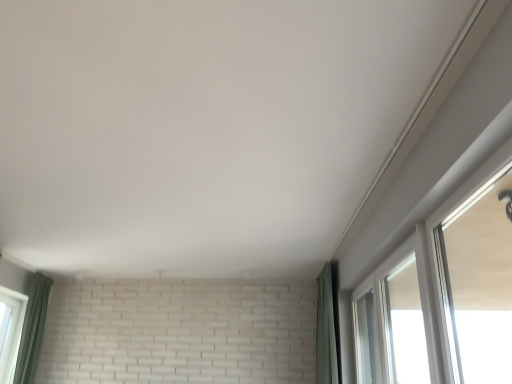
Question: Is white glossy window at upper right, positioned as the second window in back-to-front order, thinner than green fabric curtain at right, positioned as the 2th curtain in left-to-right order?

Choices:
 (A) no
 (B) yes

Answer: (B)

Question: Is white glossy window at upper right, positioned as the second window in back-to-front order, positioned behind green fabric curtain at right, positioned as the 2th curtain in left-to-right order?

Choices:
 (A) no
 (B) yes

Answer: (A)

Question: Considering the relative sizes of white glossy window at upper right, placed as the 1th window when sorted from front to back, and green fabric curtain at right, positioned as the 2th curtain in left-to-right order, in the image provided, is white glossy window at upper right, placed as the 1th window when sorted from front to back, wider than green fabric curtain at right, positioned as the 2th curtain in left-to-right order,?

Choices:
 (A) yes
 (B) no

Answer: (B)

Question: Could green fabric curtain at right, positioned as the 2th curtain in left-to-right order, be considered to be inside white glossy window at upper right, placed as the 1th window when sorted from front to back?

Choices:
 (A) yes
 (B) no

Answer: (B)

Question: Is white glossy window at upper right, placed as the 1th window when sorted from front to back, next to green fabric curtain at right, positioned as the 2th curtain in left-to-right order, and touching it?

Choices:
 (A) yes
 (B) no

Answer: (B)

Question: Considering the relative sizes of white glossy window at upper right, positioned as the second window in back-to-front order, and green fabric curtain at right, positioned as the 2th curtain in left-to-right order, in the image provided, is white glossy window at upper right, positioned as the second window in back-to-front order, bigger than green fabric curtain at right, positioned as the 2th curtain in left-to-right order,?

Choices:
 (A) no
 (B) yes

Answer: (A)

Question: Can green fabric curtain at lower left, placed as the 1th curtain when sorted from left to right, be found inside white glossy window at upper right, placed as the 1th window when sorted from front to back?

Choices:
 (A) yes
 (B) no

Answer: (B)

Question: Is white glossy window at upper right, positioned as the second window in back-to-front order, turned away from green fabric curtain at lower left, which is the second curtain in right-to-left order?

Choices:
 (A) no
 (B) yes

Answer: (A)

Question: Does white glossy window at upper right, placed as the 1th window when sorted from front to back, have a larger size compared to green fabric curtain at lower left, placed as the 1th curtain when sorted from left to right?

Choices:
 (A) yes
 (B) no

Answer: (A)

Question: From the image's perspective, does white glossy window at upper right, positioned as the second window in back-to-front order, appear lower than green fabric curtain at lower left, which is the second curtain in right-to-left order?

Choices:
 (A) yes
 (B) no

Answer: (B)

Question: Is white glossy window at upper right, positioned as the second window in back-to-front order, not inside green fabric curtain at lower left, placed as the 1th curtain when sorted from left to right?

Choices:
 (A) no
 (B) yes

Answer: (B)

Question: Does white glossy window at upper right, placed as the 1th window when sorted from front to back, come in front of green fabric curtain at lower left, which is the second curtain in right-to-left order?

Choices:
 (A) yes
 (B) no

Answer: (A)

Question: Is green fabric curtain at right, positioned as the 2th curtain in left-to-right order, touching transparent glass window at upper right, positioned as the 2th window in front-to-back order?

Choices:
 (A) no
 (B) yes

Answer: (A)